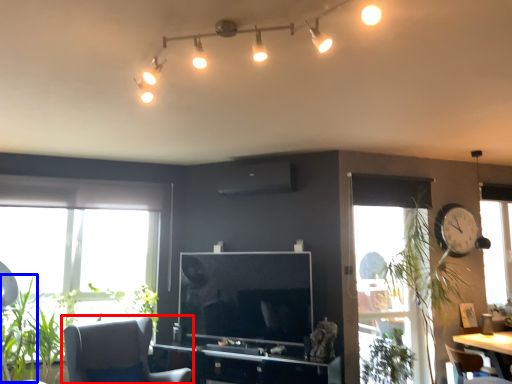
Question: Among these objects, which one is farthest to the camera, chair (highlighted by a red box) or plant (highlighted by a blue box)?

Choices:
 (A) chair
 (B) plant

Answer: (B)